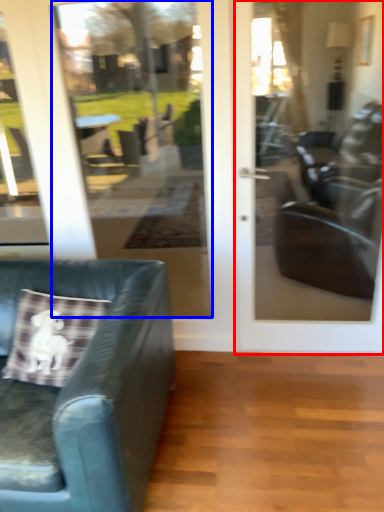
Question: Which point is closer to the camera, door (highlighted by a red box) or glass door (highlighted by a blue box)?

Choices:
 (A) door
 (B) glass door

Answer: (A)